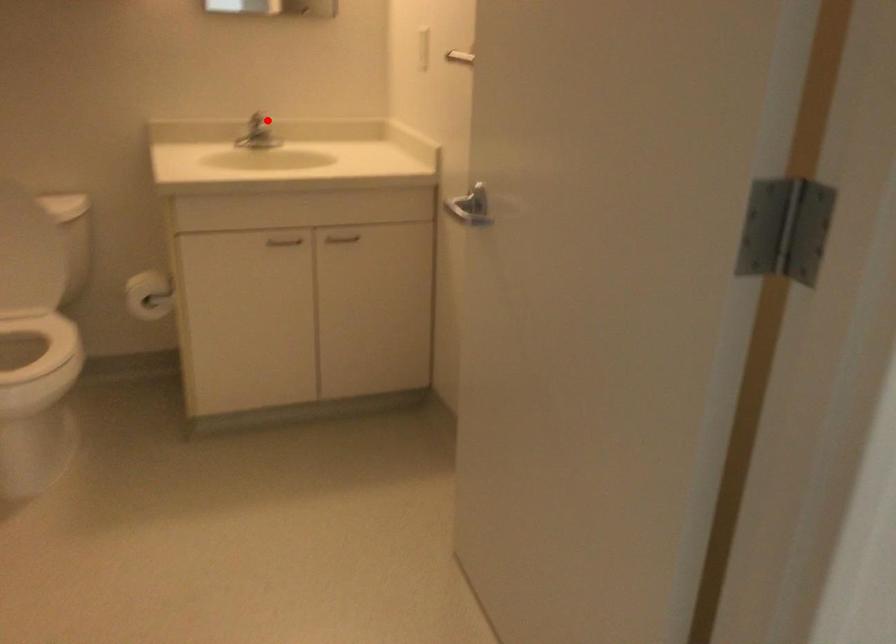
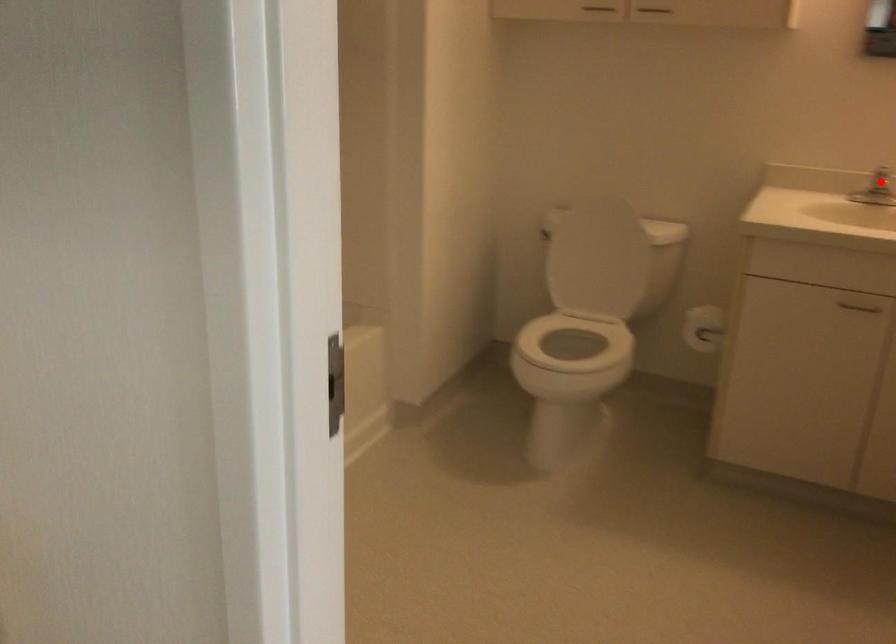
I am providing you with two images of the same scene from different viewpoints. A red point is marked on the first image and another point is marked on the second image. Do the highlighted points in image1 and image2 indicate the same real-world spot?

Yes